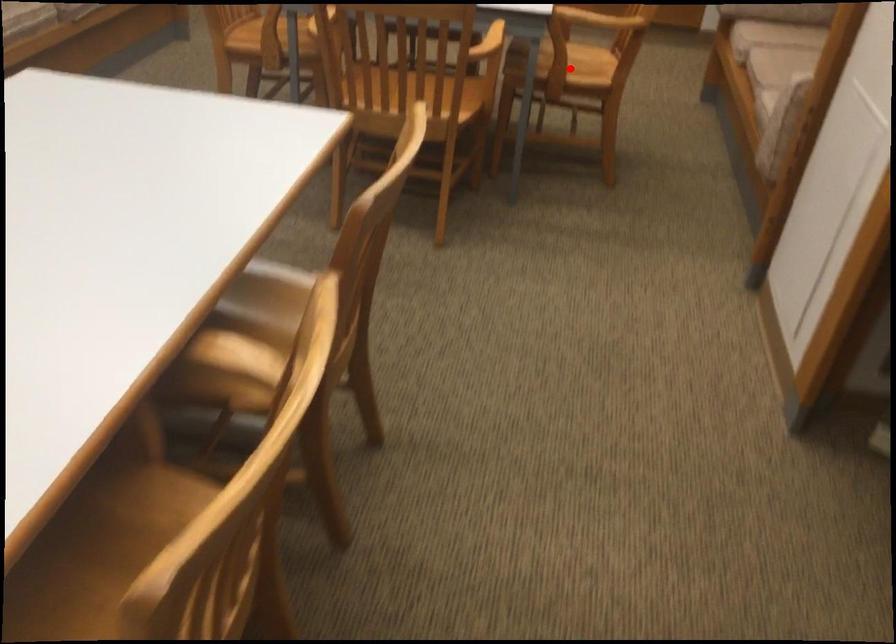
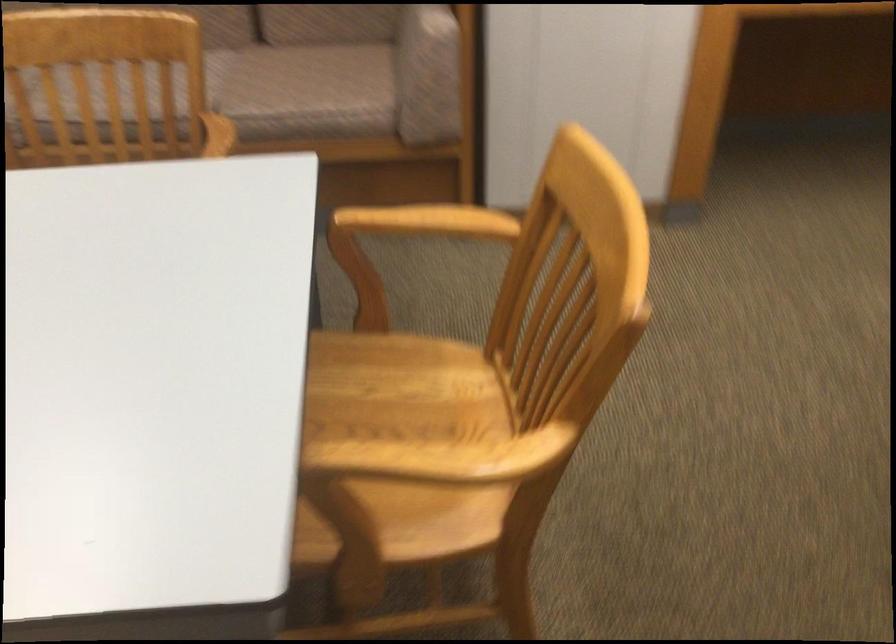
Question: I am providing you with two images of the same scene from different viewpoints. A red point is marked on the first image. Is the red point's position out of view in image 2?

Choices:
 (A) Yes
 (B) No

Answer: (A)